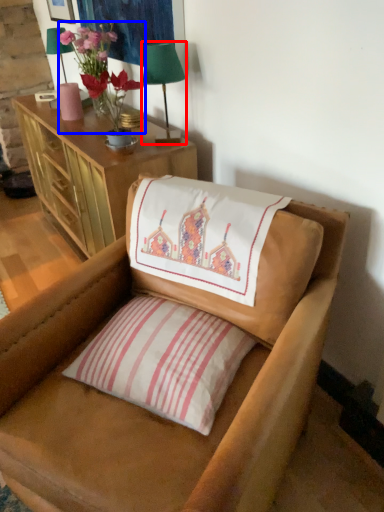
Question: Among these objects, which one is farthest to the camera, table lamp (highlighted by a red box) or floral arrangement (highlighted by a blue box)?

Choices:
 (A) table lamp
 (B) floral arrangement

Answer: (B)